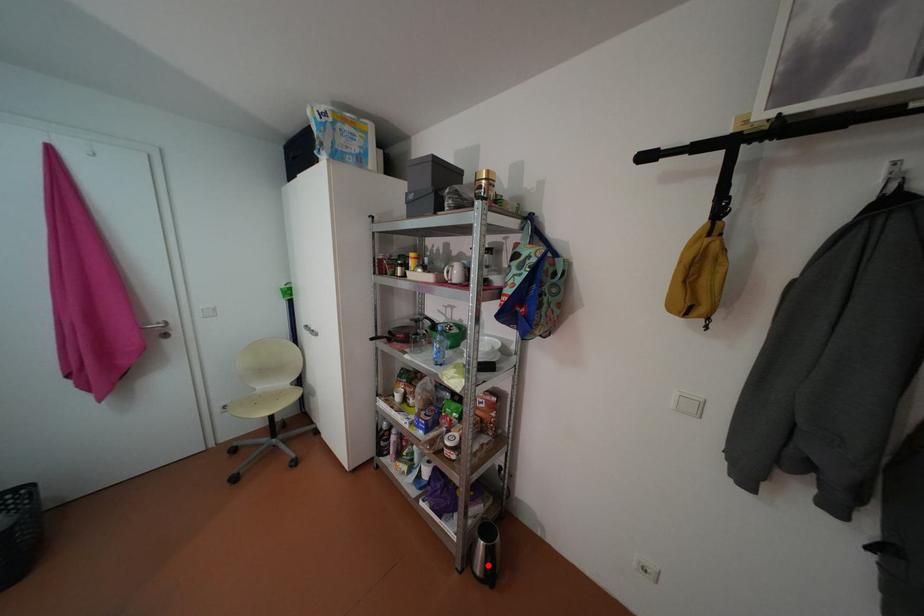
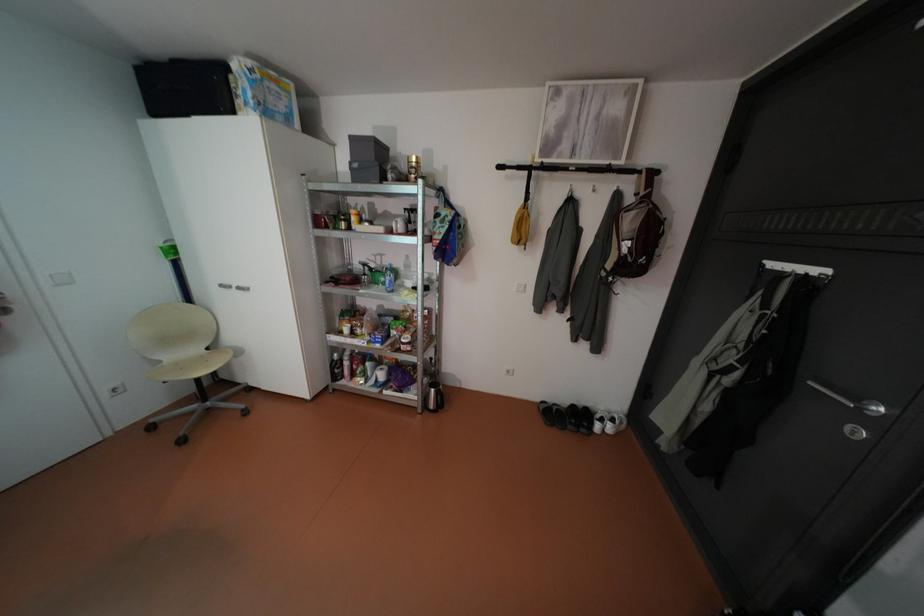
In the second image, find the point that corresponds to the highlighted location in the first image.

(441, 405)